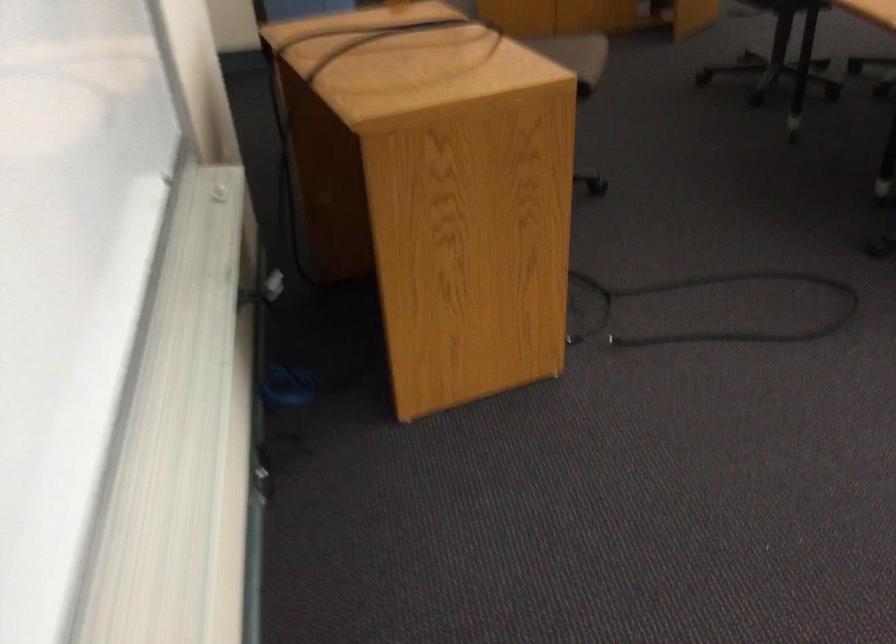
This screenshot has height=644, width=896. Describe the element at coordinates (220, 193) in the screenshot. I see `the white plastic knob` at that location.